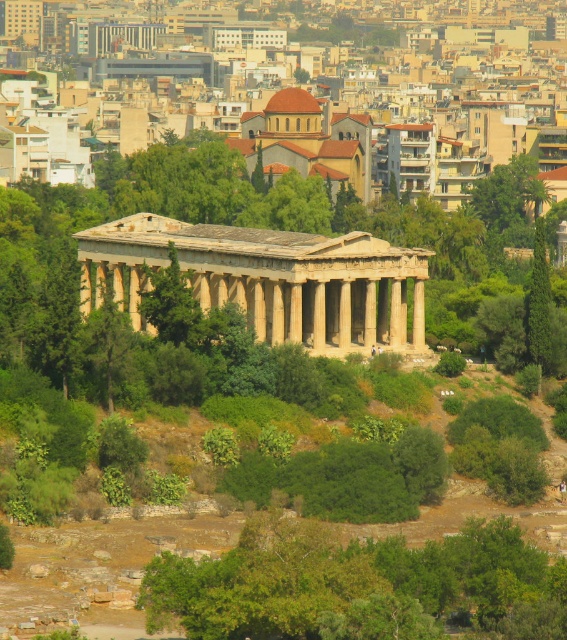
Question: Among these points, which one is farthest from the camera?

Choices:
 (A) (168, 253)
 (B) (549, 346)
 (C) (505, 202)

Answer: (C)

Question: Is green leafy tree at center positioned before green leafy tree at center-right?

Choices:
 (A) yes
 (B) no

Answer: (A)

Question: Is beige stone temple at center to the right of green leafy tree at center-right from the viewer's perspective?

Choices:
 (A) yes
 (B) no

Answer: (B)

Question: Does green leafy tree at upper center appear on the left side of green leafy tree at center-right?

Choices:
 (A) no
 (B) yes

Answer: (A)

Question: Among these points, which one is nearest to the camera?

Choices:
 (A) coord(540,188)
 (B) coord(184,289)
 (C) coord(230,269)
 (D) coord(531,266)

Answer: (B)

Question: Which object is closer to the camera taking this photo?

Choices:
 (A) green leafy tree at center-right
 (B) green leafy tree at center
 (C) green leafy tree at upper center
 (D) beige stone temple at center

Answer: (D)